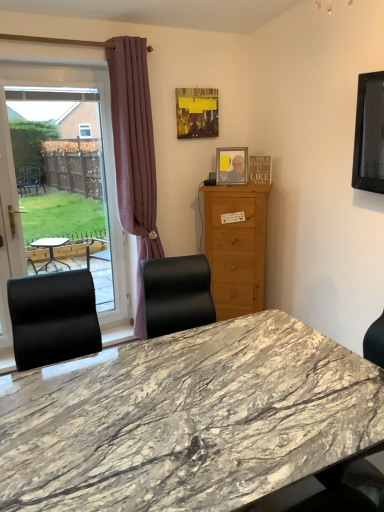
Find the location of a particular element. Image resolution: width=384 pixels, height=512 pixels. vacant point above transparent glass window at left (from a real-world perspective) is located at coordinates (55, 91).